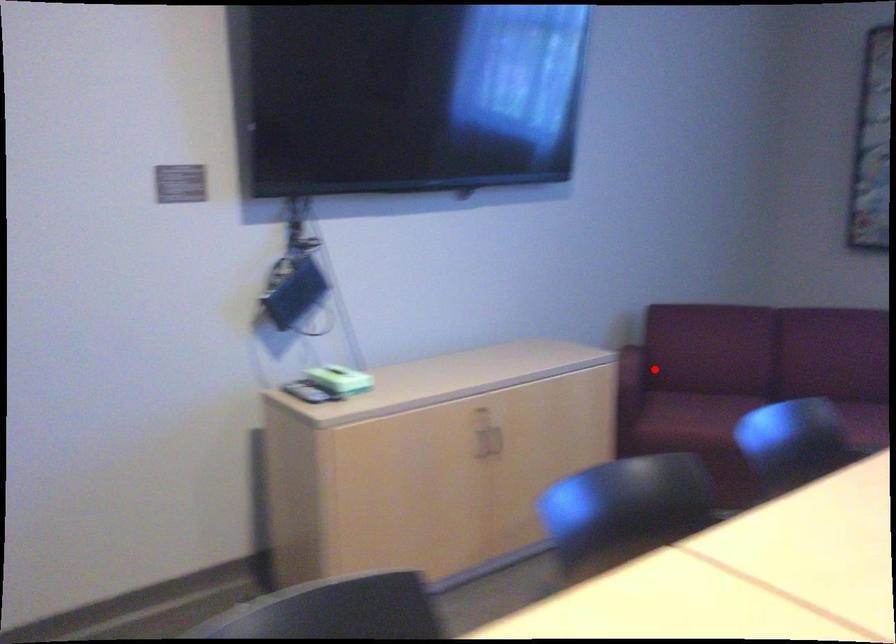
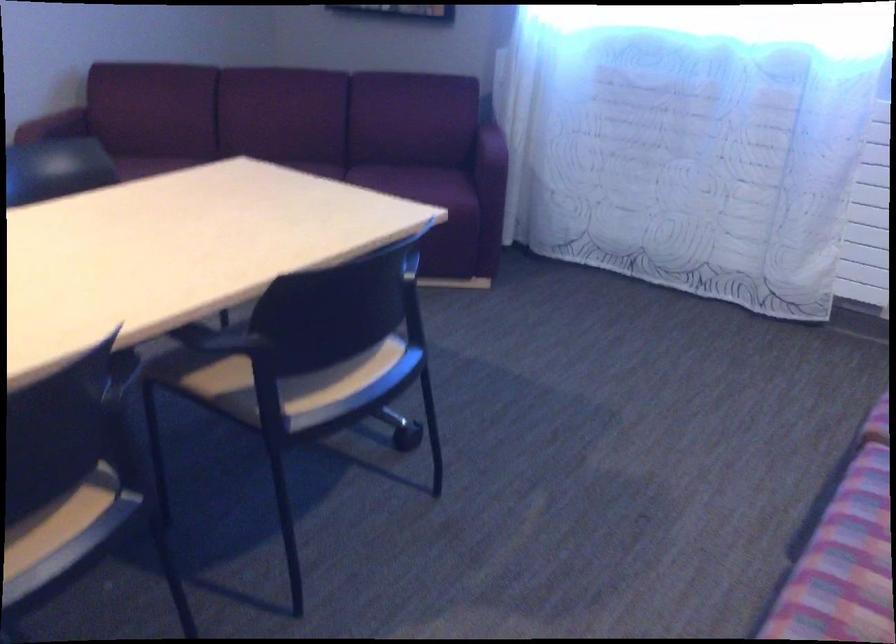
Question: I am providing you with two images of the same scene from different viewpoints. In image1, a red point is highlighted. Considering the same 3D point in image2, which of the following is correct?

Choices:
 (A) It is closer
 (B) It is farther

Answer: (A)